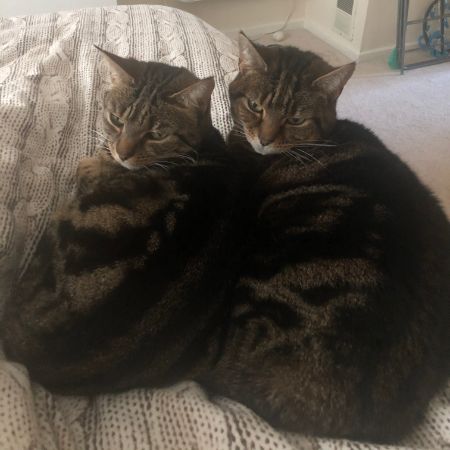
At what (x,y) coordinates should I click in order to perform the action: click on bed. Please return your answer as a coordinate pair (x, y). Image resolution: width=450 pixels, height=450 pixels. Looking at the image, I should click on (125, 422).